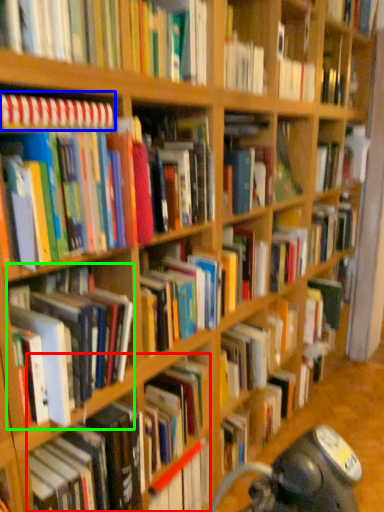
Question: Considering the real-world distances, which object is closest to book (highlighted by a red box)? book (highlighted by a blue box) or book (highlighted by a green box).

Choices:
 (A) book
 (B) book

Answer: (B)